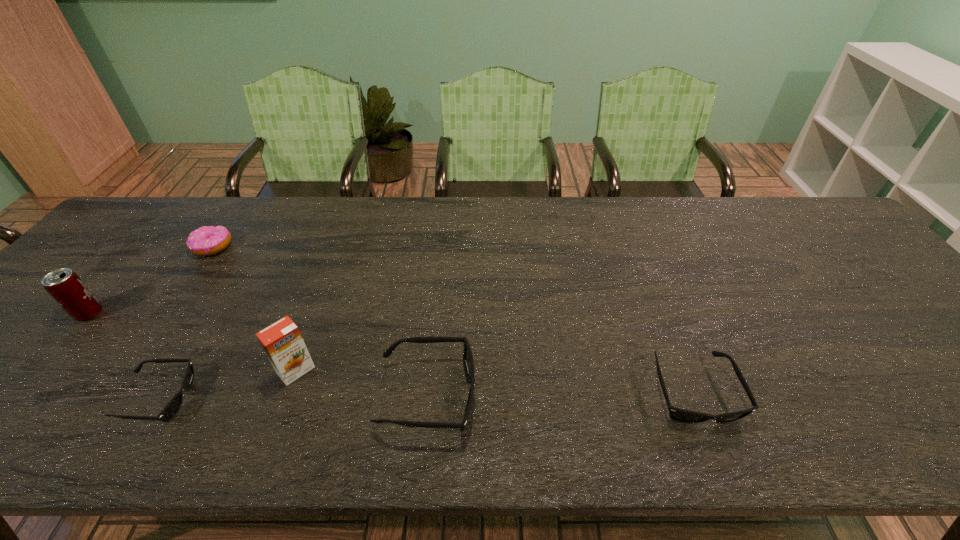
Image resolution: width=960 pixels, height=540 pixels. I want to click on the leftmost sunglasses, so click(x=171, y=409).

Locate an element on the screen. The height and width of the screenshot is (540, 960). the second sunglasses from right to left is located at coordinates (468, 363).

Locate an element on the screen. the fifth object from left to right is located at coordinates (468, 363).

Find the location of a particular element. the rightmost object is located at coordinates (677, 414).

Identify the location of the second tallest sunglasses. (677, 414).

The image size is (960, 540). Find the location of `the fifth nearest object`. the fifth nearest object is located at coordinates (65, 286).

Identify the location of beer can. The image size is (960, 540). (65, 286).

You are a GUI agent. You are given a task and a screenshot of the screen. Output one action in this format:
    pyautogui.click(x=<x>, y=<y>)
    Task: Click on the doughnut
    
    Given the screenshot: What is the action you would take?
    pyautogui.click(x=205, y=241)

Find the location of a particular element. The image size is (960, 540). orange juice is located at coordinates (282, 342).

Identify the location of free space located on the front-facing side of the shortest sunglasses. (224, 399).